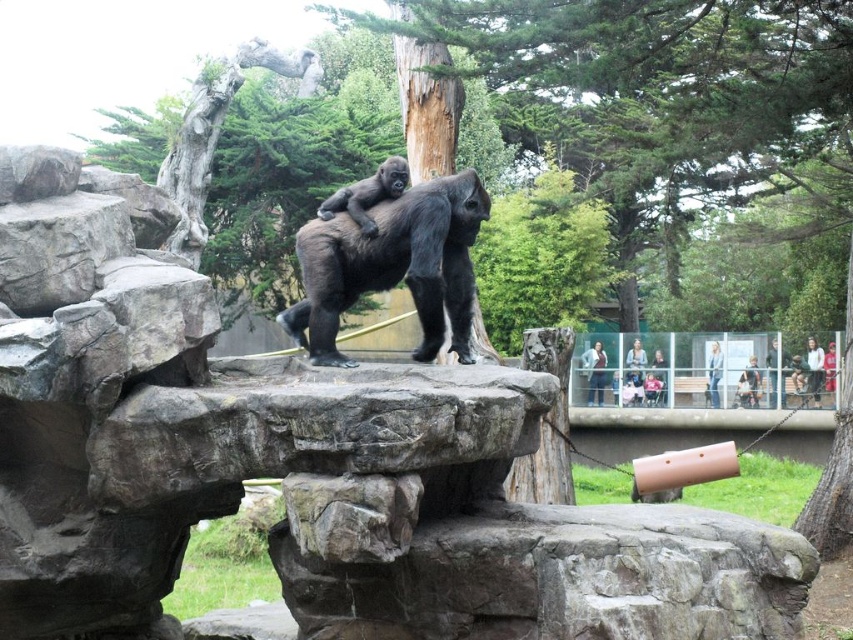
Question: Can you confirm if brown concrete ledge at lower right is positioned to the right of black matte gorilla at center?

Choices:
 (A) no
 (B) yes

Answer: (B)

Question: Does rough textured rock at center appear over brown concrete ledge at lower right?

Choices:
 (A) no
 (B) yes

Answer: (B)

Question: Which point is farther to the camera?

Choices:
 (A) (704, 412)
 (B) (671, 532)
 (C) (373, 189)

Answer: (A)

Question: Which object appears closest to the camera in this image?

Choices:
 (A) brown concrete ledge at lower right
 (B) shiny black gorilla at center
 (C) rough textured rock at center
 (D) black matte gorilla at center

Answer: (C)

Question: Which object appears farthest from the camera in this image?

Choices:
 (A) shiny black gorilla at center
 (B) black matte gorilla at center
 (C) brown concrete ledge at lower right
 (D) rough textured rock at center

Answer: (C)

Question: Can you confirm if rough textured rock at center is bigger than shiny black gorilla at center?

Choices:
 (A) no
 (B) yes

Answer: (B)